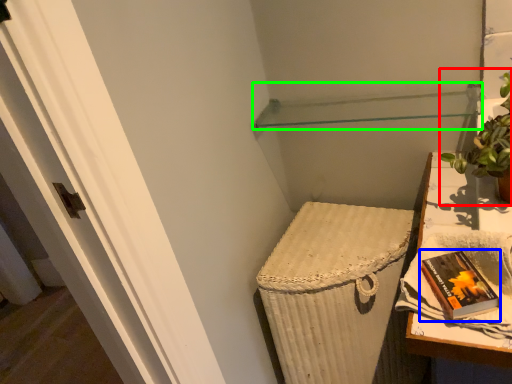
Question: Considering the real-world distances, which object is closest to houseplant (highlighted by a red box)? paperback book (highlighted by a blue box) or shelf (highlighted by a green box).

Choices:
 (A) paperback book
 (B) shelf

Answer: (A)